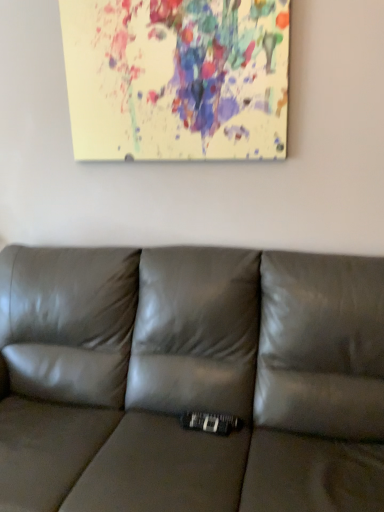
Question: Is paint splatter canvas at upper center inside the boundaries of satin gray leather couch at center, or outside?

Choices:
 (A) outside
 (B) inside

Answer: (A)

Question: Considering the positions of paint splatter canvas at upper center and satin gray leather couch at center in the image, is paint splatter canvas at upper center wider or thinner than satin gray leather couch at center?

Choices:
 (A) thin
 (B) wide

Answer: (A)

Question: From a real-world perspective, is paint splatter canvas at upper center physically located above or below satin gray leather couch at center?

Choices:
 (A) above
 (B) below

Answer: (A)

Question: Would you say satin gray leather couch at center is inside or outside paint splatter canvas at upper center?

Choices:
 (A) outside
 (B) inside

Answer: (A)

Question: Considering the positions of satin gray leather couch at center and paint splatter canvas at upper center in the image, is satin gray leather couch at center taller or shorter than paint splatter canvas at upper center?

Choices:
 (A) short
 (B) tall

Answer: (B)

Question: From the image's perspective, is satin gray leather couch at center located above or below paint splatter canvas at upper center?

Choices:
 (A) below
 (B) above

Answer: (A)

Question: Relative to paint splatter canvas at upper center, is satin gray leather couch at center in front or behind?

Choices:
 (A) behind
 (B) front

Answer: (B)